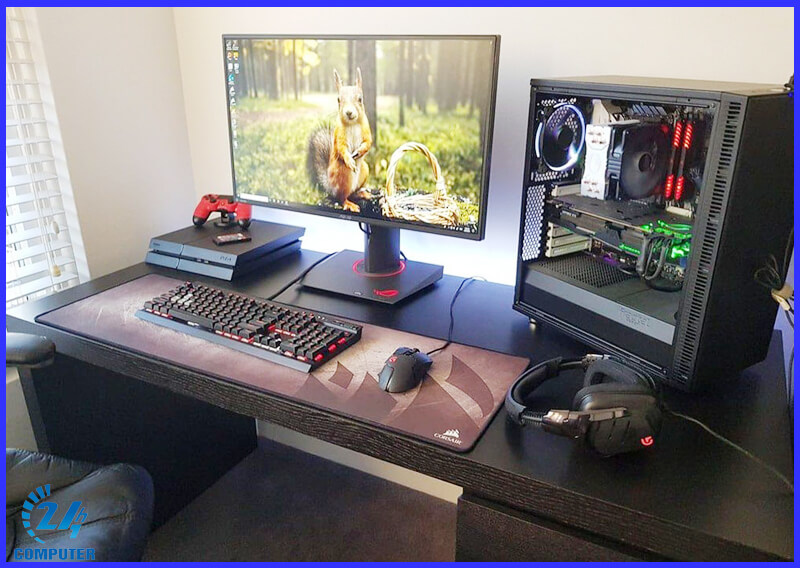
Where is `computer`? This screenshot has width=800, height=568. computer is located at coordinates (586, 200).